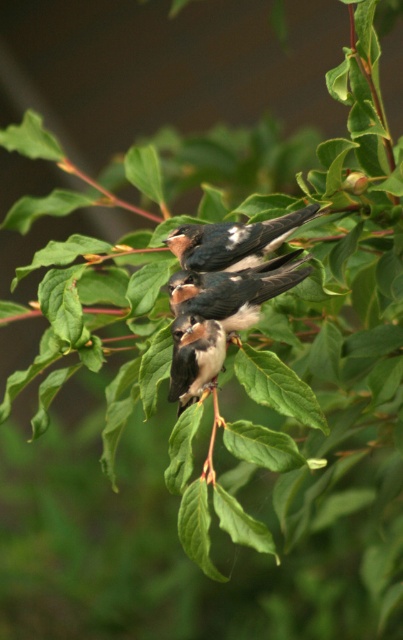
Who is more forward, (290, 227) or (209, 337)?

Point (209, 337) is more forward.

Between speckled feathered swallow at center and brown speckled feathers at center, which one is positioned higher?

speckled feathered swallow at center is above.

Who is more distant from viewer, (240, 227) or (213, 358)?

The point (240, 227) is more distant.

This screenshot has width=403, height=640. In order to click on speckled feathered swallow at center in this screenshot , I will do `click(232, 241)`.

Can you confirm if brown feathered bird at center is wider than speckled feathered swallow at center?

Incorrect, brown feathered bird at center's width does not surpass speckled feathered swallow at center's.

Describe the element at coordinates (234, 291) in the screenshot. I see `brown feathered bird at center` at that location.

Where is `brown feathered bird at center`? Image resolution: width=403 pixels, height=640 pixels. brown feathered bird at center is located at coordinates (234, 291).

Is brown feathered bird at center thinner than brown speckled feathers at center?

No, brown feathered bird at center is not thinner than brown speckled feathers at center.

Does brown feathered bird at center appear over brown speckled feathers at center?

Correct, brown feathered bird at center is located above brown speckled feathers at center.

From the picture: Measure the distance between point (236, 296) and camera.

The distance of point (236, 296) from camera is 5.48 feet.

Where is `brown feathered bird at center`? Image resolution: width=403 pixels, height=640 pixels. brown feathered bird at center is located at coordinates (234, 291).